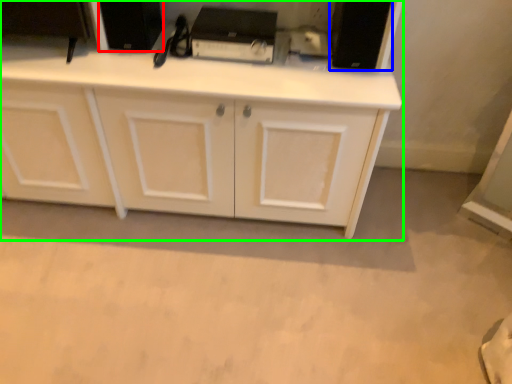
Question: Based on their relative distances, which object is nearer to appliance (highlighted by a red box)? Choose from appliance (highlighted by a blue box) and cabinetry (highlighted by a green box).

Choices:
 (A) appliance
 (B) cabinetry

Answer: (B)